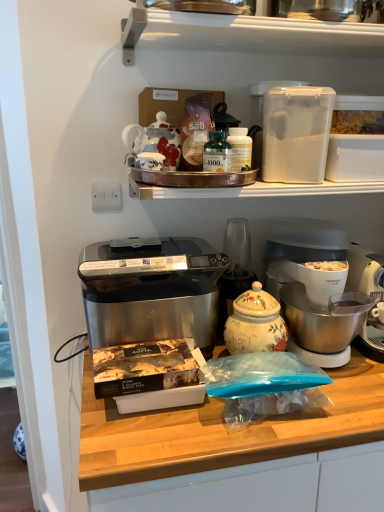
In the scene shown: What is the approximate height of decorative ceramic jar at center?

decorative ceramic jar at center is 9.96 inches in height.

At what (x,y) coordinates should I click in order to perform the action: click on porcelain teapot at upper center, marked as the second appliance in a right-to-left arrangement. Please return your answer as a coordinate pair (x, y). This screenshot has width=384, height=512. Looking at the image, I should click on [156, 143].

What is the approximate height of stainless steel appliance at center?

The height of stainless steel appliance at center is 93.90 centimeters.

Locate an element on the screen. The image size is (384, 512). transparent plastic container at upper right, the 1th appliance positioned from the right is located at coordinates (295, 131).

At what (x,y) coordinates should I click in order to perform the action: click on green glass bottle at center. Please return your answer as a coordinate pair (x, y). Looking at the image, I should click on (217, 153).

The width and height of the screenshot is (384, 512). Describe the element at coordinates (217, 153) in the screenshot. I see `green glass bottle at center` at that location.

Where is `white plastic coffee maker at lower right`? white plastic coffee maker at lower right is located at coordinates (324, 287).

Find the location of a particular element. satin black toaster oven at center is located at coordinates tap(153, 294).

From a real-world perspective, does decorative ceramic jar at center stand above transparent plastic container at upper right, which appears as the second appliance when viewed from the left?

No, from a real-world perspective, decorative ceramic jar at center is not over transparent plastic container at upper right, which appears as the second appliance when viewed from the left

Is transparent plastic container at upper right, the 1th appliance positioned from the right, at the back of decorative ceramic jar at center?

No, decorative ceramic jar at center's orientation is not away from transparent plastic container at upper right, the 1th appliance positioned from the right.

Is decorative ceramic jar at center further to camera compared to transparent plastic container at upper right, the 1th appliance positioned from the right?

Yes, it is.

From the picture: Can you confirm if white plastic container at upper center is positioned to the left of transparent plastic container at upper right, the 1th appliance positioned from the right?

Correct, you'll find white plastic container at upper center to the left of transparent plastic container at upper right, the 1th appliance positioned from the right.

From the image's perspective, which one is positioned lower, white plastic container at upper center or transparent plastic container at upper right, the 1th appliance positioned from the right?

transparent plastic container at upper right, the 1th appliance positioned from the right, appears lower in the image.

Based on the photo, how many degrees apart are the facing directions of white plastic container at upper center and transparent plastic container at upper right, the 1th appliance positioned from the right?

The angle between the facing direction of white plastic container at upper center and the facing direction of transparent plastic container at upper right, the 1th appliance positioned from the right, is 0.517 degrees.

Between white plastic coffee maker at lower right and stainless steel appliance at center, which one has smaller size?

white plastic coffee maker at lower right is smaller.

Is stainless steel appliance at center located within white plastic coffee maker at lower right?

No.

Can you tell me how much white plastic coffee maker at lower right and decorative ceramic jar at center differ in facing direction?

The facing directions of white plastic coffee maker at lower right and decorative ceramic jar at center are 1.36 degrees apart.

Considering the sizes of objects white plastic coffee maker at lower right and decorative ceramic jar at center in the image provided, who is smaller, white plastic coffee maker at lower right or decorative ceramic jar at center?

Smaller between the two is decorative ceramic jar at center.

Where is `coffee maker lying above the decorative ceramic jar at center (from the image's perspective)`? coffee maker lying above the decorative ceramic jar at center (from the image's perspective) is located at coordinates (324, 287).

Based on the photo, how much distance is there between satin black toaster oven at center and porcelain teapot at upper center, marked as the second appliance in a right-to-left arrangement?

satin black toaster oven at center is 12.69 inches from porcelain teapot at upper center, marked as the second appliance in a right-to-left arrangement.

From a real-world perspective, is satin black toaster oven at center over porcelain teapot at upper center, arranged as the 1th appliance when viewed from the left?

No, from a real-world perspective, satin black toaster oven at center is not on top of porcelain teapot at upper center, arranged as the 1th appliance when viewed from the left.

Is porcelain teapot at upper center, marked as the second appliance in a right-to-left arrangement, at the back of satin black toaster oven at center?

No, porcelain teapot at upper center, marked as the second appliance in a right-to-left arrangement, is not at the back of satin black toaster oven at center.

Looking at this image, considering the relative sizes of satin black toaster oven at center and porcelain teapot at upper center, arranged as the 1th appliance when viewed from the left, in the image provided, is satin black toaster oven at center thinner than porcelain teapot at upper center, arranged as the 1th appliance when viewed from the left,?

Incorrect, the width of satin black toaster oven at center is not less than that of porcelain teapot at upper center, arranged as the 1th appliance when viewed from the left.

Is the depth of stainless steel appliance at center less than that of white plastic coffee maker at lower right?

Yes, stainless steel appliance at center is closer to the viewer.

How far apart are stainless steel appliance at center and white plastic coffee maker at lower right?

stainless steel appliance at center and white plastic coffee maker at lower right are 11.54 inches apart from each other.

Is stainless steel appliance at center with white plastic coffee maker at lower right?

There is a gap between stainless steel appliance at center and white plastic coffee maker at lower right.

From the image's perspective, is green glass bottle at center above stainless steel appliance at center?

Yes, from the image's perspective, green glass bottle at center is over stainless steel appliance at center.

Relative to stainless steel appliance at center, is green glass bottle at center in front or behind?

green glass bottle at center is positioned farther from the viewer than stainless steel appliance at center.

Identify the location of bottle above the stainless steel appliance at center (from the image's perspective). (217, 153).

Considering the relative sizes of green glass bottle at center and stainless steel appliance at center in the image provided, is green glass bottle at center shorter than stainless steel appliance at center?

Indeed, green glass bottle at center has a lesser height compared to stainless steel appliance at center.

The height and width of the screenshot is (512, 384). Find the location of `appliance in front of the decorative ceramic jar at center`. appliance in front of the decorative ceramic jar at center is located at coordinates (295, 131).

Find the location of a particular element. shelf that appears on the left of transparent plastic container at upper right, which appears as the second appliance when viewed from the left is located at coordinates (245, 34).

Estimate the real-world distances between objects in this image. Which object is further from stainless steel appliance at center, white plastic coffee maker at lower right or satin black toaster oven at center?

white plastic coffee maker at lower right is further to stainless steel appliance at center.

Considering their positions, is stainless steel appliance at center positioned closer to white plastic coffee maker at lower right than white plastic container at upper center?

stainless steel appliance at center lies closer to white plastic coffee maker at lower right than the other object.

Which object lies further to the anchor point transparent plastic container at upper right, the 1th appliance positioned from the right, green glass bottle at center or white plastic container at upper center?

white plastic container at upper center is positioned further to the anchor transparent plastic container at upper right, the 1th appliance positioned from the right.

From the image, which object appears to be nearer to green glass bottle at center, stainless steel appliance at center or white plastic container at upper center?

white plastic container at upper center lies closer to green glass bottle at center than the other object.

Estimate the real-world distances between objects in this image. Which object is closer to green glass bottle at center, white plastic container at upper center or decorative ceramic jar at center?

Among the two, white plastic container at upper center is located nearer to green glass bottle at center.

Which object lies further to the anchor point satin black toaster oven at center, transparent plastic container at upper right, which appears as the second appliance when viewed from the left, or stainless steel appliance at center?

transparent plastic container at upper right, which appears as the second appliance when viewed from the left.

Looking at the image, which one is located further to stainless steel appliance at center, satin black toaster oven at center or white plastic coffee maker at lower right?

white plastic coffee maker at lower right is positioned further to the anchor stainless steel appliance at center.

Looking at the image, which one is located closer to stainless steel appliance at center, decorative ceramic jar at center or porcelain teapot at upper center, marked as the second appliance in a right-to-left arrangement?

Based on the image, decorative ceramic jar at center appears to be nearer to stainless steel appliance at center.

Locate an element on the screen. This screenshot has width=384, height=512. bottle between porcelain teapot at upper center, marked as the second appliance in a right-to-left arrangement, and decorative ceramic jar at center vertically is located at coordinates (217, 153).

Find the location of `coffee maker between white plastic container at upper center and decorative ceramic jar at center vertically`. coffee maker between white plastic container at upper center and decorative ceramic jar at center vertically is located at coordinates (324, 287).

In order to click on home appliance that lies between white plastic coffee maker at lower right and stainless steel appliance at center from top to bottom in this screenshot , I will do `click(153, 294)`.

Locate an element on the screen. The image size is (384, 512). bottle between white plastic container at upper center and stainless steel appliance at center from top to bottom is located at coordinates (217, 153).